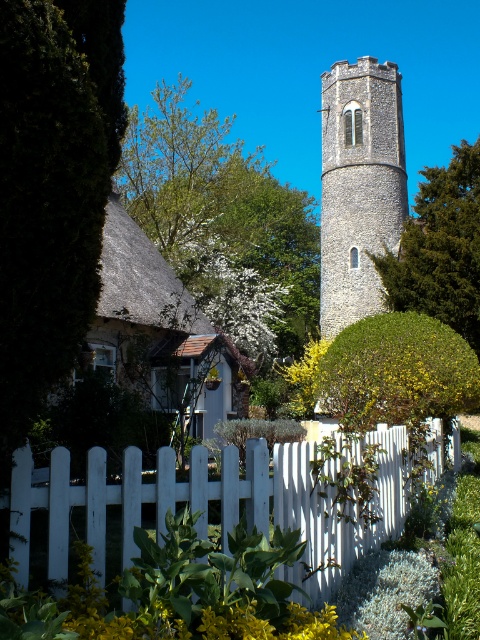
Question: From the image, what is the correct spatial relationship of white picket fence at lower center in relation to white fluffy flower at center?

Choices:
 (A) above
 (B) below

Answer: (B)

Question: Observing the image, what is the correct spatial positioning of green leafy tree at upper center in reference to yellow matte flower at center?

Choices:
 (A) right
 (B) left

Answer: (B)

Question: Which point is farther from the camera taking this photo?

Choices:
 (A) coord(375,273)
 (B) coord(396,436)
 (C) coord(271,296)

Answer: (C)

Question: Which object is positioned farthest from the white picket fence at lower center?

Choices:
 (A) stone tower at center
 (B) white fluffy flower at center
 (C) green leafy tree at upper center
 (D) dark green leafy tree at left

Answer: (C)

Question: Is yellow matte flower at lower center closer to camera compared to white fluffy flower at center?

Choices:
 (A) yes
 (B) no

Answer: (A)

Question: Which is nearer to the green leafy tree at center?

Choices:
 (A) white picket fence at lower center
 (B) yellow matte flower at center
 (C) green leafy tree at upper center

Answer: (B)